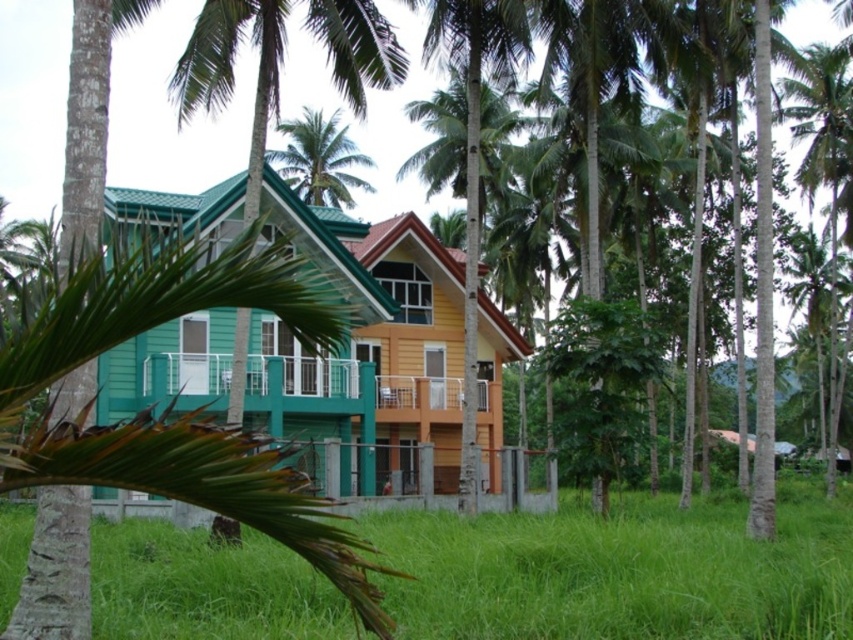
Is point (762, 580) positioned behind point (503, 60)?

No, it is in front of (503, 60).

Does green grass at lower center have a lesser height compared to green leafy palm tree at center?

Correct, green grass at lower center is not as tall as green leafy palm tree at center.

Between point (550, 621) and point (457, 490), which one is positioned behind?

The point (457, 490) is more distant.

What are the coordinates of `green grass at lower center` in the screenshot? It's located at (622, 570).

In the scene shown: Who is more distant from viewer, (476, 227) or (369, 161)?

The point (369, 161) is behind.

Based on the photo, who is more forward, (448, 13) or (300, 129)?

Positioned in front is point (448, 13).

The width and height of the screenshot is (853, 640). In order to click on green leafy palm tree at center in this screenshot , I will do `click(474, 163)`.

This screenshot has width=853, height=640. What do you see at coordinates (622, 570) in the screenshot? I see `green grass at lower center` at bounding box center [622, 570].

Does green grass at lower center have a larger size compared to green leafy palm tree at upper center?

No.

The width and height of the screenshot is (853, 640). In order to click on green grass at lower center in this screenshot , I will do `click(622, 570)`.

You are a GUI agent. You are given a task and a screenshot of the screen. Output one action in this format:
    pyautogui.click(x=<x>, y=<y>)
    Task: Click on the green grass at lower center
    The width and height of the screenshot is (853, 640).
    Given the screenshot: What is the action you would take?
    pyautogui.click(x=622, y=570)